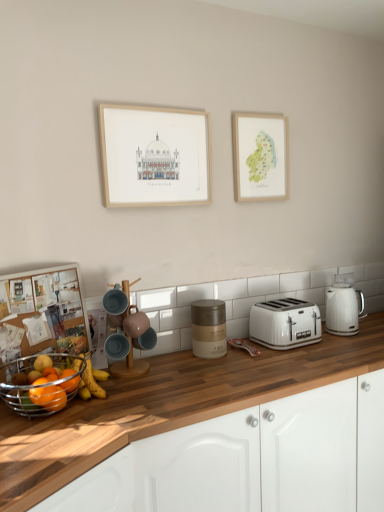
Question: Is matte wooden picture frame at upper center, placed as the second picture frame when sorted from right to left, smaller than watercolor paper map at upper right, the first picture frame viewed from the back?

Choices:
 (A) no
 (B) yes

Answer: (A)

Question: Is matte wooden picture frame at upper center, the 1th picture frame positioned from the left, to the left of watercolor paper map at upper right, the 1th picture frame when ordered from right to left, from the viewer's perspective?

Choices:
 (A) yes
 (B) no

Answer: (A)

Question: Is matte wooden picture frame at upper center, the second picture frame from the back, wider than watercolor paper map at upper right, the 2th picture frame in the front-to-back sequence?

Choices:
 (A) no
 (B) yes

Answer: (B)

Question: Does matte wooden picture frame at upper center, the second picture frame from the back, contain watercolor paper map at upper right, the first picture frame viewed from the back?

Choices:
 (A) no
 (B) yes

Answer: (A)

Question: Is matte wooden picture frame at upper center, placed as the second picture frame when sorted from right to left, to the right of watercolor paper map at upper right, the 2th picture frame in the front-to-back sequence, from the viewer's perspective?

Choices:
 (A) yes
 (B) no

Answer: (B)

Question: Does matte wooden picture frame at upper center, placed as the first picture frame when sorted from front to back, have a lesser height compared to watercolor paper map at upper right, which is counted as the second picture frame, starting from the left?

Choices:
 (A) no
 (B) yes

Answer: (B)

Question: Considering the relative sizes of matte blue mug at center, the 4th appliance in the right-to-left sequence, and matte gold canister at center, the 2th appliance viewed from the right, in the image provided, is matte blue mug at center, the 4th appliance in the right-to-left sequence, taller than matte gold canister at center, the 2th appliance viewed from the right,?

Choices:
 (A) yes
 (B) no

Answer: (B)

Question: Is matte blue mug at center, the 4th appliance in the right-to-left sequence, not near matte gold canister at center, which is the second appliance in back-to-front order?

Choices:
 (A) no
 (B) yes

Answer: (A)

Question: From the image's perspective, is matte blue mug at center, the 4th appliance in the right-to-left sequence, located above matte gold canister at center, the 2th appliance viewed from the right?

Choices:
 (A) no
 (B) yes

Answer: (A)

Question: Considering the relative sizes of matte blue mug at center, the 4th appliance in the right-to-left sequence, and matte gold canister at center, the 2th appliance viewed from the right, in the image provided, is matte blue mug at center, the 4th appliance in the right-to-left sequence, smaller than matte gold canister at center, the 2th appliance viewed from the right,?

Choices:
 (A) yes
 (B) no

Answer: (A)

Question: Would you say matte gold canister at center, which is the second appliance in back-to-front order, is part of matte blue mug at center, which appears as the 3th appliance when viewed from the back,'s contents?

Choices:
 (A) no
 (B) yes

Answer: (A)

Question: Can you confirm if matte blue mug at center, which appears as the 3th appliance when viewed from the back, is shorter than matte gold canister at center, which is the second appliance in back-to-front order?

Choices:
 (A) yes
 (B) no

Answer: (A)

Question: Could you tell me if matte ceramic mug at center, positioned as the third appliance in right-to-left order, is turned towards matte ceramic coffee machine at center?

Choices:
 (A) yes
 (B) no

Answer: (A)